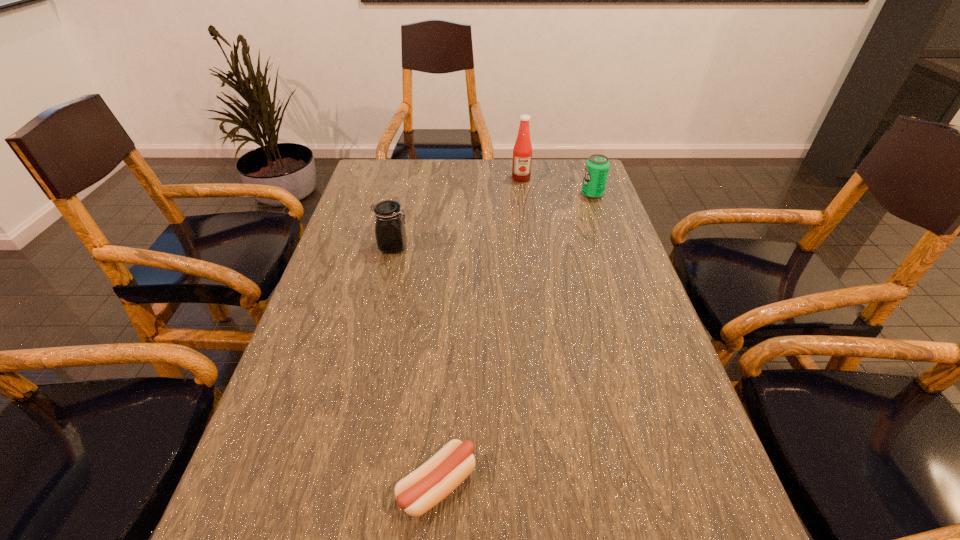
The image size is (960, 540). In order to click on the farthest object in this screenshot , I will do `click(522, 152)`.

What are the coordinates of `the tallest object` in the screenshot? It's located at (522, 152).

Locate an element on the screen. The height and width of the screenshot is (540, 960). the leftmost object is located at coordinates (390, 231).

You are a GUI agent. You are given a task and a screenshot of the screen. Output one action in this format:
    pyautogui.click(x=<x>, y=<y>)
    Task: Click on the third farthest object
    The image size is (960, 540).
    Given the screenshot: What is the action you would take?
    pyautogui.click(x=390, y=231)

Image resolution: width=960 pixels, height=540 pixels. Find the location of `the third nearest object`. the third nearest object is located at coordinates (597, 166).

Identify the location of pop soda. The image size is (960, 540). (597, 166).

This screenshot has width=960, height=540. Find the location of `the shortest object`. the shortest object is located at coordinates (418, 492).

Locate an element on the screen. the second object from left to right is located at coordinates (418, 492).

Where is `vacant space located on the front-facing side of the condiment`? The width and height of the screenshot is (960, 540). vacant space located on the front-facing side of the condiment is located at coordinates (530, 247).

Where is `free location located on the lid of the jar`? free location located on the lid of the jar is located at coordinates (520, 247).